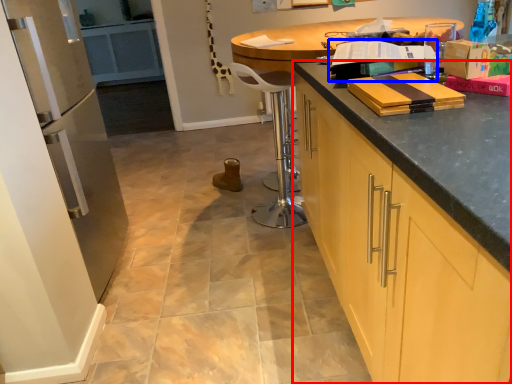
Question: Which object appears farthest to the camera in this image, cabinetry (highlighted by a red box) or book (highlighted by a blue box)?

Choices:
 (A) cabinetry
 (B) book

Answer: (B)